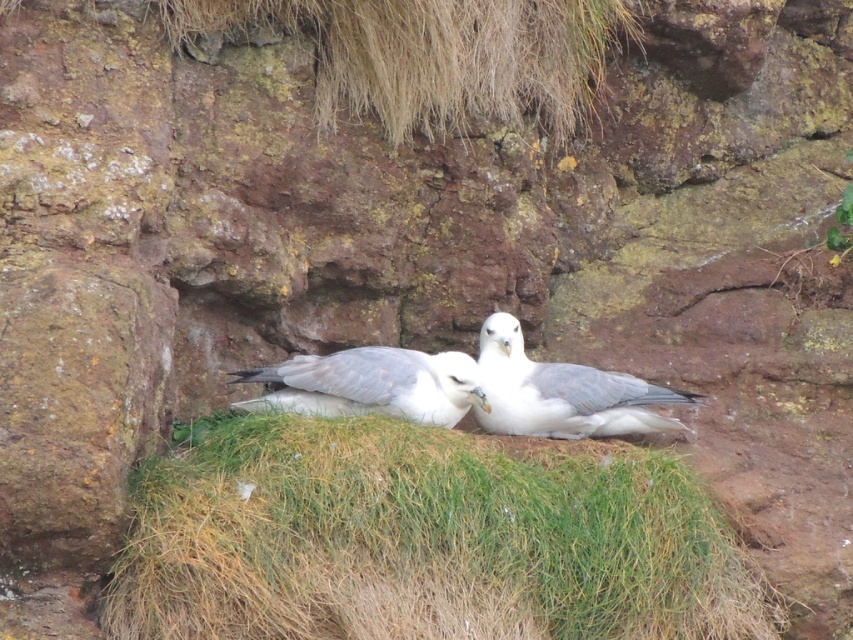
Question: Does white matte bird at center appear under white feathered bird at center?

Choices:
 (A) no
 (B) yes

Answer: (B)

Question: Which object is positioned farthest from the white matte bird at center?

Choices:
 (A) green grass at center
 (B) white feathered bird at center

Answer: (A)

Question: Which point is closer to the camera taking this photo?

Choices:
 (A) (444, 369)
 (B) (630, 401)

Answer: (A)

Question: Which object is closer to the camera taking this photo?

Choices:
 (A) white feathered bird at center
 (B) white matte bird at center
 (C) green grass at center

Answer: (C)

Question: Does white matte bird at center appear on the right side of white feathered bird at center?

Choices:
 (A) no
 (B) yes

Answer: (B)

Question: Is green grass at center above white feathered bird at center?

Choices:
 (A) no
 (B) yes

Answer: (A)